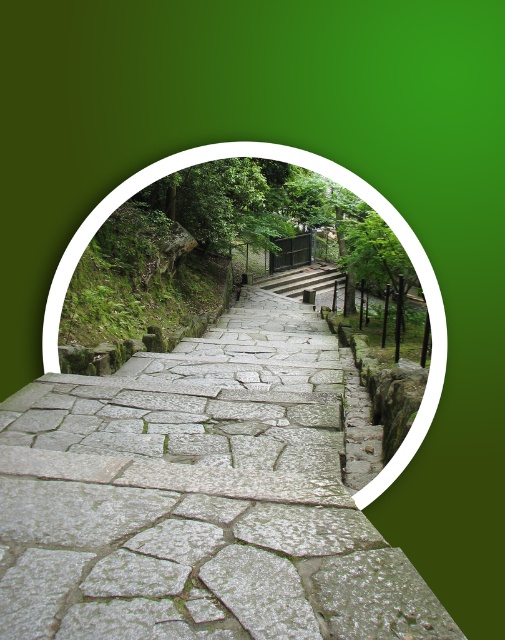
Does gray stone steps at center appear over gray stone stairs at center?

No.

Measure the distance between gray stone steps at center and gray stone stairs at center.

gray stone steps at center and gray stone stairs at center are 4.86 feet apart.

Is point (285, 563) positioned before point (52, 317)?

Yes, it is in front of point (52, 317).

The width and height of the screenshot is (505, 640). I want to click on gray stone steps at center, so coord(198,497).

Based on the photo, is gray stone steps at center thinner than stone steps at center?

Correct, gray stone steps at center's width is less than stone steps at center's.

Between point (335, 547) and point (323, 284), which one is positioned in front?

Point (335, 547) is in front.

This screenshot has height=640, width=505. Identify the location of gray stone steps at center. (198, 497).

Who is lower down, gray stone stairs at center or stone steps at center?

gray stone stairs at center

Can you confirm if gray stone stairs at center is thinner than stone steps at center?

Yes.

Does point (354, 177) come closer to viewer compared to point (289, 276)?

That is True.

Locate an element on the screen. gray stone stairs at center is located at coordinates (317, 172).